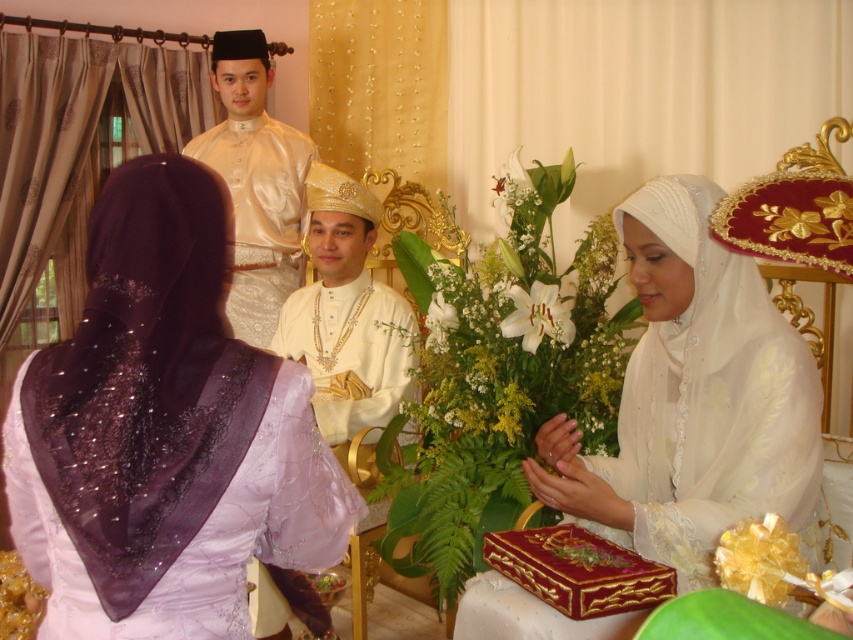
Question: Can you confirm if white sheer veil at center is positioned above white lily at center?

Choices:
 (A) no
 (B) yes

Answer: (A)

Question: Does white sheer veil at center lie behind white silk bouquet at center?

Choices:
 (A) no
 (B) yes

Answer: (A)

Question: Which point is farther to the camera?

Choices:
 (A) purple satin hijab at left
 (B) satin gold outfit at upper center
 (C) matte gold crown at center

Answer: (B)

Question: Which point appears farthest from the camera in this image?

Choices:
 (A) (563, 451)
 (B) (509, 324)
 (C) (251, 208)

Answer: (C)

Question: Among these points, which one is nearest to the camera?

Choices:
 (A) (245, 243)
 (B) (416, 458)
 (C) (339, 330)

Answer: (B)

Question: Can you confirm if matte gold crown at center is positioned to the right of white lily at center?

Choices:
 (A) no
 (B) yes

Answer: (A)